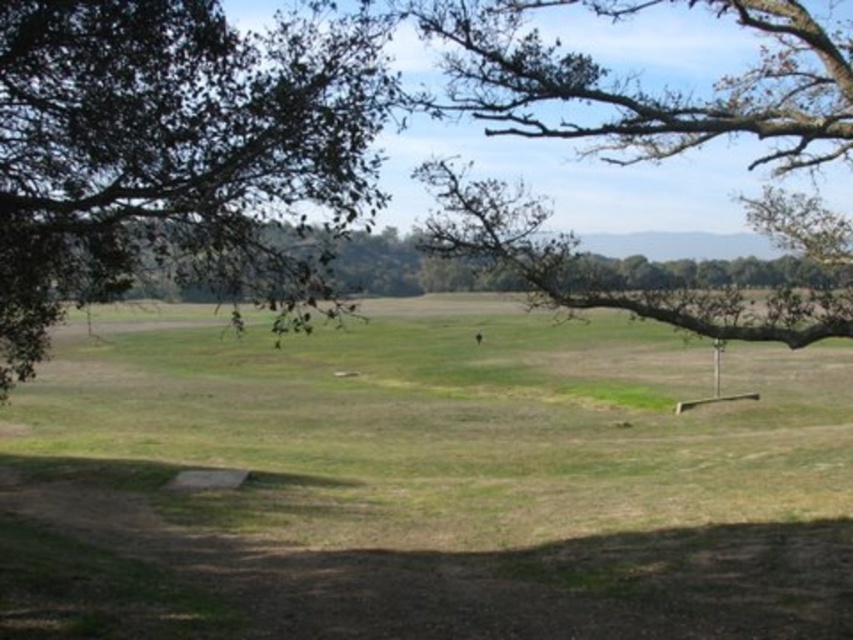
Can you confirm if green leafy tree at upper left is positioned to the left of brown textured branch at upper right?

Indeed, green leafy tree at upper left is positioned on the left side of brown textured branch at upper right.

Is green leafy tree at upper left below brown textured branch at upper right?

Indeed, green leafy tree at upper left is positioned under brown textured branch at upper right.

Is point (151, 129) positioned behind point (596, 102)?

That is False.

At what (x,y) coordinates should I click in order to perform the action: click on green leafy tree at upper left. Please return your answer as a coordinate pair (x, y). The width and height of the screenshot is (853, 640). Looking at the image, I should click on (172, 150).